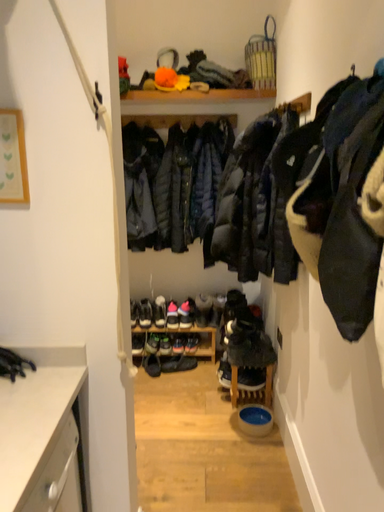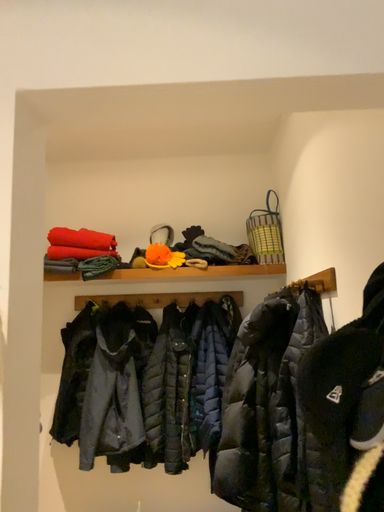
Question: How did the camera likely rotate when shooting the video?

Choices:
 (A) rotated downward
 (B) rotated upward

Answer: (B)